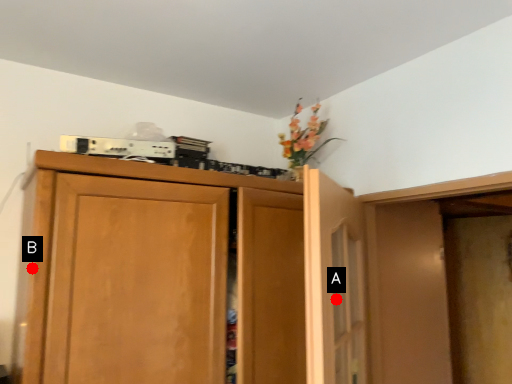
Question: Two points are circled on the image, labeled by A and B beside each circle. Which point is further to the camera?

Choices:
 (A) A is further
 (B) B is further

Answer: (A)